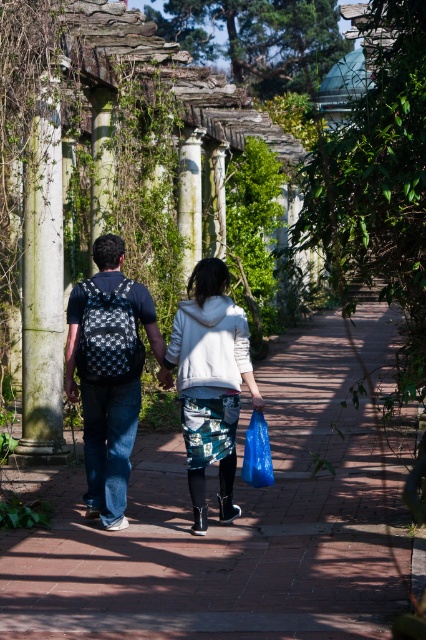
Question: Considering the real-world distances, which object is closest to the white stone column at left?

Choices:
 (A) blue plastic bag at center
 (B) brick pavement at center

Answer: (B)

Question: Considering the relative positions of brick pavement at center and white stone column at left in the image provided, where is brick pavement at center located with respect to white stone column at left?

Choices:
 (A) right
 (B) left

Answer: (A)

Question: Based on their relative distances, which object is nearer to the matte black backpack at center?

Choices:
 (A) brick pavement at center
 (B) blue plastic bag at center
 (C) white fleece jacket at center

Answer: (C)

Question: Which point is farther to the camera?

Choices:
 (A) (104, 365)
 (B) (213, 342)
 (C) (49, 356)

Answer: (C)

Question: Is white fleece jacket at center smaller than matte black backpack at center?

Choices:
 (A) yes
 (B) no

Answer: (A)

Question: Can you confirm if brick pavement at center is positioned to the left of white fleece jacket at center?

Choices:
 (A) no
 (B) yes

Answer: (A)